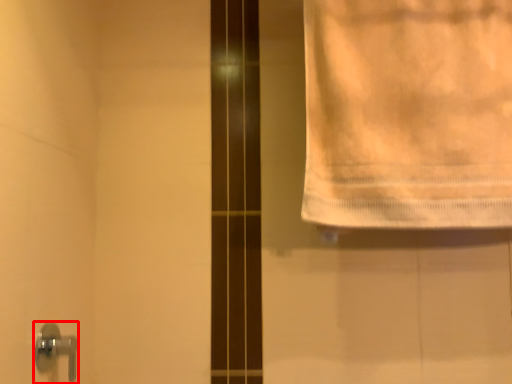
Question: From the image's perspective, where is door handle (annotated by the red box) located in relation to towel in the image?

Choices:
 (A) above
 (B) below

Answer: (B)